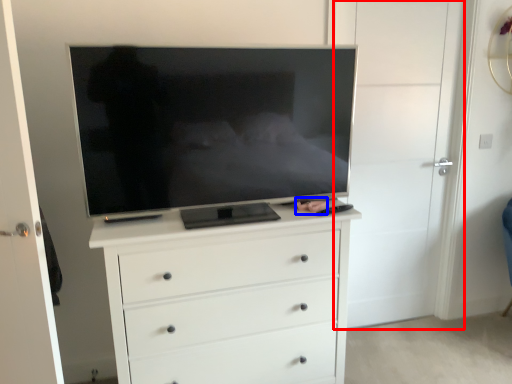
Question: Which point is further to the camera, door (highlighted by a red box) or person (highlighted by a blue box)?

Choices:
 (A) door
 (B) person

Answer: (A)